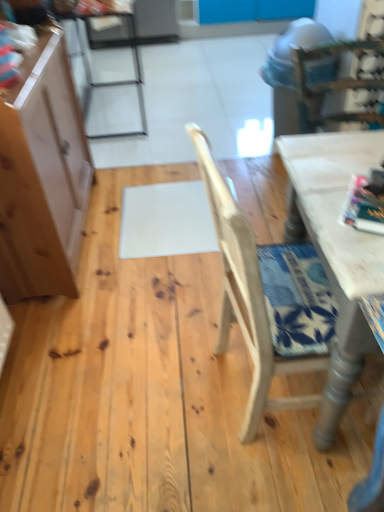
Describe the element at coordinates (323, 172) in the screenshot. I see `white matte table at upper right` at that location.

This screenshot has width=384, height=512. What are the coordinates of `light brown wood chair at center, which appears as the second chair when viewed from the left` in the screenshot? It's located at (267, 298).

At what (x,y) coordinates should I click in order to perform the action: click on white painted wood table at right. Please return your answer as a coordinate pair (x, y). Looking at the image, I should click on (336, 250).

Identify the location of metallic silver chair at upper left, which is the 1th chair from back to front. This screenshot has height=512, width=384. (x=133, y=58).

Locate an element on the screen. This screenshot has height=512, width=384. light brown wood cabinet at left is located at coordinates (42, 176).

Would you say metallic silver chair at upper left, which is the 2th chair in right-to-left order, is inside or outside light brown wood chair at center, which is the first chair from bottom to top?

metallic silver chair at upper left, which is the 2th chair in right-to-left order, exists outside the volume of light brown wood chair at center, which is the first chair from bottom to top.

Which object is thinner, metallic silver chair at upper left, the 1th chair in the left-to-right sequence, or light brown wood chair at center, which is the first chair from bottom to top?

metallic silver chair at upper left, the 1th chair in the left-to-right sequence.

Could you measure the distance between metallic silver chair at upper left, which is the second chair from bottom to top, and light brown wood chair at center, the first chair viewed from the right?

A distance of 7.26 feet exists between metallic silver chair at upper left, which is the second chair from bottom to top, and light brown wood chair at center, the first chair viewed from the right.

Which is behind, point (89, 41) or point (293, 214)?

The point (89, 41) is more distant.

Based on the photo, which object is closer to the camera taking this photo, metallic silver chair at upper left, which is the 1th chair from back to front, or white painted wood table at right?

white painted wood table at right is in front.

Can white painted wood table at right be found inside metallic silver chair at upper left, the 1th chair in the left-to-right sequence?

Definitely not — white painted wood table at right is not inside metallic silver chair at upper left, the 1th chair in the left-to-right sequence.

Does metallic silver chair at upper left, which is the second chair from bottom to top, have a lesser height compared to white painted wood table at right?

Incorrect, the height of metallic silver chair at upper left, which is the second chair from bottom to top, does not fall short of that of white painted wood table at right.

Is point (327, 198) behind point (34, 256)?

No, it is not.

How much distance is there between white matte table at upper right and light brown wood cabinet at left?

A distance of 38.58 inches exists between white matte table at upper right and light brown wood cabinet at left.

Considering the relative sizes of white matte table at upper right and light brown wood cabinet at left in the image provided, is white matte table at upper right taller than light brown wood cabinet at left?

Incorrect, the height of white matte table at upper right is not larger of that of light brown wood cabinet at left.

Is white matte table at upper right directly adjacent to light brown wood cabinet at left?

No, white matte table at upper right is not making contact with light brown wood cabinet at left.

Locate an element on the screen. This screenshot has height=512, width=384. table top behind the light brown wood chair at center, which is the first chair from bottom to top is located at coordinates (323, 172).

From a real-world perspective, is light brown wood chair at center, the first chair viewed from the right, located higher than white matte table at upper right?

No, from a real-world perspective, light brown wood chair at center, the first chair viewed from the right, is not on top of white matte table at upper right.

Considering the sizes of objects light brown wood chair at center, the first chair viewed from the right, and white matte table at upper right in the image provided, who is smaller, light brown wood chair at center, the first chair viewed from the right, or white matte table at upper right?

Smaller between the two is white matte table at upper right.

Considering the sizes of objects light brown wood chair at center, which is the first chair from bottom to top, and white matte table at upper right in the image provided, who is thinner, light brown wood chair at center, which is the first chair from bottom to top, or white matte table at upper right?

white matte table at upper right is thinner.

Would you consider metallic silver chair at upper left, the 2th chair when ordered from front to back, to be distant from white matte table at upper right?

Indeed, metallic silver chair at upper left, the 2th chair when ordered from front to back, is not near white matte table at upper right.

From the image's perspective, is metallic silver chair at upper left, the 2th chair when ordered from front to back, positioned above or below white matte table at upper right?

metallic silver chair at upper left, the 2th chair when ordered from front to back, is above white matte table at upper right.

Which is in front, point (126, 7) or point (343, 179)?

Positioned in front is point (343, 179).

Based on the photo, relative to white matte table at upper right, is light brown wood cabinet at left in front or behind?

light brown wood cabinet at left is in front of white matte table at upper right.

Locate an element on the screen. Image resolution: width=384 pixels, height=512 pixels. cabinetry above the white matte table at upper right (from the image's perspective) is located at coordinates click(x=42, y=176).

Is light brown wood cabinet at left positioned with its back to white matte table at upper right?

No, light brown wood cabinet at left is not facing the opposite direction of white matte table at upper right.

Does light brown wood cabinet at left have a greater width compared to white matte table at upper right?

No, light brown wood cabinet at left is not wider than white matte table at upper right.

Is light brown wood cabinet at left oriented towards white painted wood table at right?

No, light brown wood cabinet at left is not oriented towards white painted wood table at right.

How distant is light brown wood cabinet at left from white painted wood table at right?

light brown wood cabinet at left is 1.01 meters from white painted wood table at right.

Considering the positions of point (65, 222) and point (342, 372), is point (65, 222) closer or farther from the camera than point (342, 372)?

Point (65, 222) is positioned farther from the camera compared to point (342, 372).

Which of these two, light brown wood cabinet at left or white painted wood table at right, stands taller?

light brown wood cabinet at left is taller.

This screenshot has height=512, width=384. I want to click on chair that is on the right side of metallic silver chair at upper left, which is the 1th chair from back to front, so click(x=267, y=298).

This screenshot has width=384, height=512. I want to click on the 2nd chair above when counting from the white painted wood table at right (from the image's perspective), so click(133, 58).

From the image, which object appears to be nearer to light brown wood cabinet at left, white painted wood table at right or light brown wood chair at center, the first chair viewed from the right?

light brown wood chair at center, the first chair viewed from the right.

Which object lies nearer to the anchor point metallic silver chair at upper left, which is the 1th chair from back to front, white matte table at upper right or white painted wood table at right?

white matte table at upper right is closer to metallic silver chair at upper left, which is the 1th chair from back to front.

Which object lies nearer to the anchor point light brown wood cabinet at left, metallic silver chair at upper left, which is the second chair from bottom to top, or light brown wood chair at center, which is the first chair from bottom to top?

light brown wood chair at center, which is the first chair from bottom to top, is positioned closer to the anchor light brown wood cabinet at left.

Which object lies further to the anchor point white painted wood table at right, metallic silver chair at upper left, which is the second chair from bottom to top, or light brown wood cabinet at left?

metallic silver chair at upper left, which is the second chair from bottom to top.

Which object lies nearer to the anchor point white painted wood table at right, white matte table at upper right or light brown wood cabinet at left?

Based on the image, white matte table at upper right appears to be nearer to white painted wood table at right.

Which object lies nearer to the anchor point light brown wood cabinet at left, white painted wood table at right or metallic silver chair at upper left, which is the second chair from bottom to top?

white painted wood table at right lies closer to light brown wood cabinet at left than the other object.

Which object lies further to the anchor point light brown wood cabinet at left, light brown wood chair at center, which is the first chair from bottom to top, or white painted wood table at right?

white painted wood table at right is further to light brown wood cabinet at left.

Considering their positions, is light brown wood cabinet at left positioned closer to white matte table at upper right than light brown wood chair at center, placed as the 1th chair when sorted from front to back?

light brown wood chair at center, placed as the 1th chair when sorted from front to back, is positioned closer to the anchor white matte table at upper right.

Image resolution: width=384 pixels, height=512 pixels. I want to click on table top between white painted wood table at right and metallic silver chair at upper left, positioned as the first chair in top-to-bottom order, in the front-back direction, so click(323, 172).

Locate an element on the screen. The height and width of the screenshot is (512, 384). table top positioned between light brown wood chair at center, the first chair viewed from the right, and metallic silver chair at upper left, which is the 2th chair in right-to-left order, from near to far is located at coordinates (323, 172).

At what (x,y) coordinates should I click in order to perform the action: click on table top positioned between light brown wood cabinet at left and metallic silver chair at upper left, the 1th chair in the left-to-right sequence, from near to far. Please return your answer as a coordinate pair (x, y). Looking at the image, I should click on (323, 172).

Image resolution: width=384 pixels, height=512 pixels. I want to click on table between light brown wood chair at center, the first chair viewed from the right, and metallic silver chair at upper left, which is the 2th chair in right-to-left order, in the front-back direction, so click(336, 250).